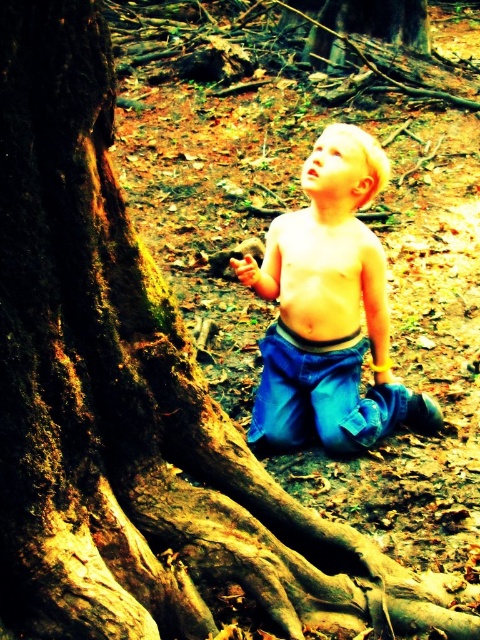
This screenshot has height=640, width=480. I want to click on blue denim jeans at center, so click(328, 308).